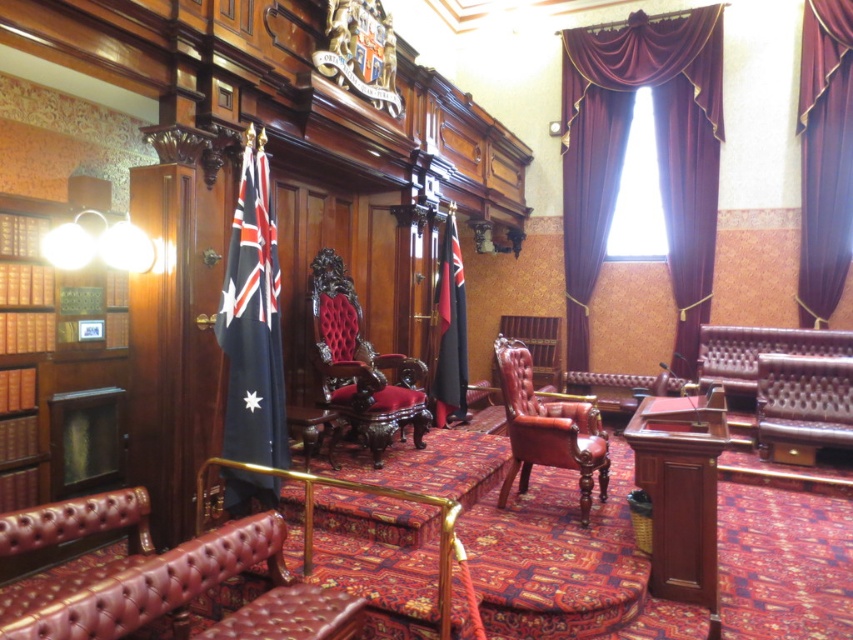
In the scene shown: You are an interior designer tasked with placing a decorative vase between the leather armchair at center and the black fabric flag at center. According to the scene description, which object should the vase be placed closer to?

The leather armchair at center is positioned on the right side of black fabric flag at center, so the vase should be placed closer to the black fabric flag at center to maintain symmetry between the two objects.

Looking at this image, you are an interior designer planning to hang a decorative plaque measuring 12 inches in width. You need to place it on the wall near the point marked as point (659, 156). Considering the space around this point, will the plaque fit without overlapping any existing elements?

The point (659, 156) indicates velvet drapery at upper right. Since the drapery is likely a large, flowing fabric element, there should be sufficient space to place the plaque nearby without overlapping, provided the exact placement avoids the drapery itself.

You are an interior designer planning to install a spotlight above the leather armchair at center and the black fabric flag at center. Based on their positions, where should you place the spotlight to illuminate both objects effectively?

The leather armchair at center is located below the black fabric flag at center, so placing the spotlight above the black fabric flag at center would illuminate both the flag and the armchair beneath it.